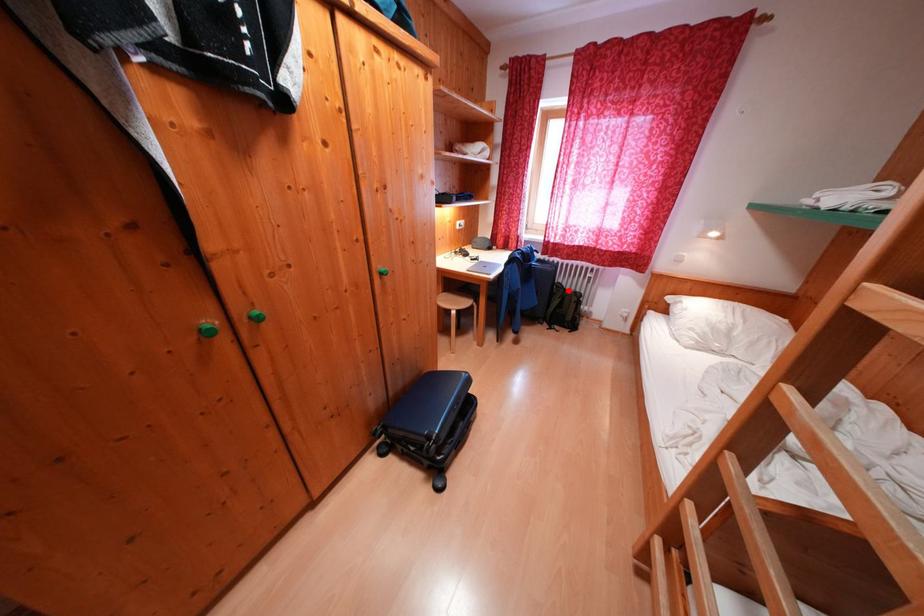
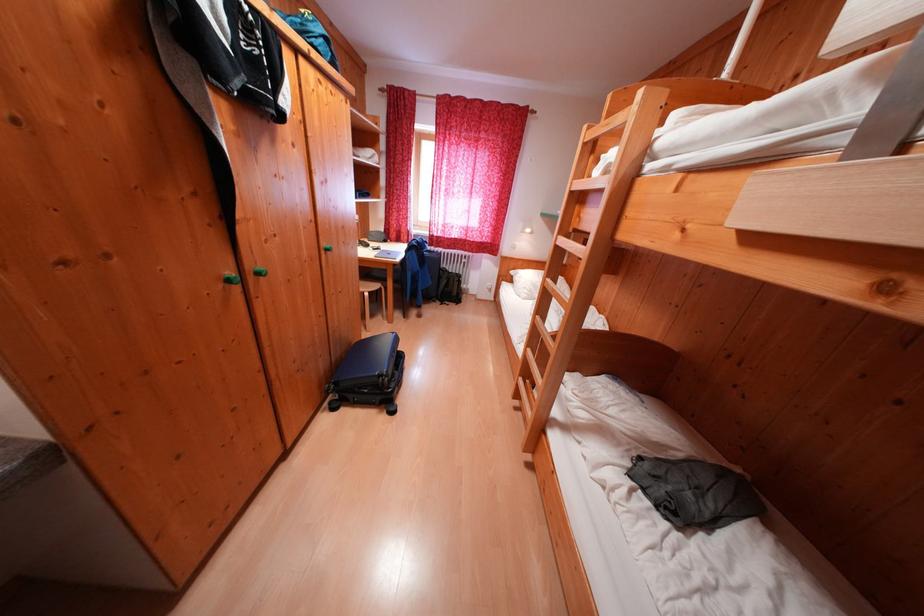
Question: I am providing you with two images of the same scene from different viewpoints. In image1, a red point is highlighted. Considering the same 3D point in image2, which of the following is correct?

Choices:
 (A) It is closer
 (B) It is farther

Answer: (A)